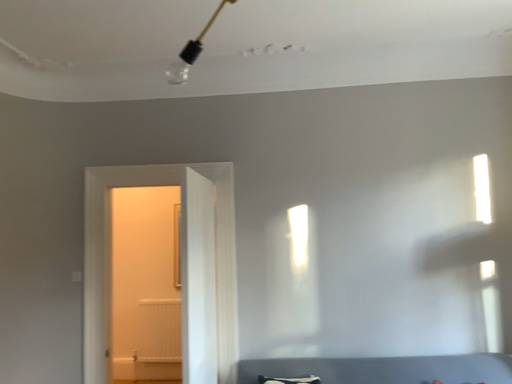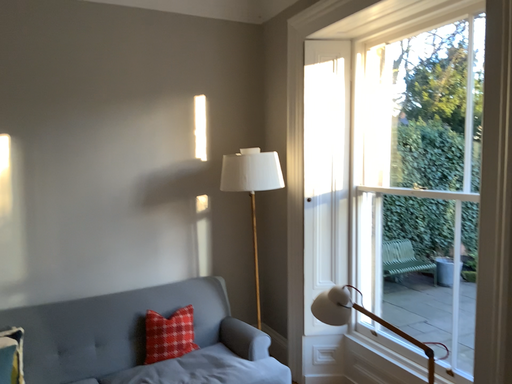
Question: How did the camera likely rotate when shooting the video?

Choices:
 (A) rotated upward
 (B) rotated downward

Answer: (B)